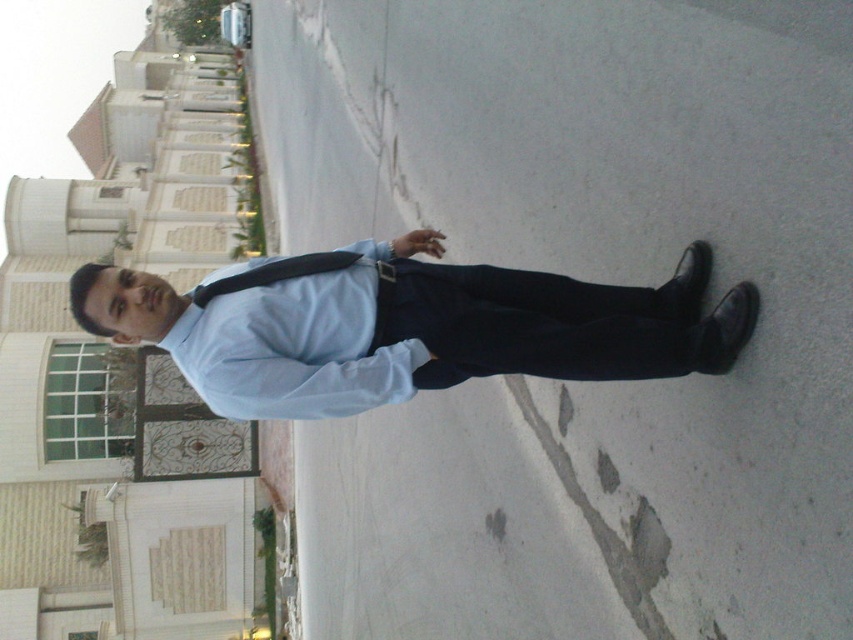
Can you confirm if matte blue shirt at center is positioned below light blue cotton dress shirt at center?

No, matte blue shirt at center is not below light blue cotton dress shirt at center.

Does matte blue shirt at center come in front of light blue cotton dress shirt at center?

Yes, matte blue shirt at center is closer to the viewer.

Between point (416, 294) and point (357, 278), which one is positioned behind?

The point (357, 278) is more distant.

This screenshot has width=853, height=640. What are the coordinates of `matte blue shirt at center` in the screenshot? It's located at (405, 324).

Is dark blue fabric pants at center wider than light blue cotton dress shirt at center?

Yes, dark blue fabric pants at center is wider than light blue cotton dress shirt at center.

Which is more to the left, dark blue fabric pants at center or light blue cotton dress shirt at center?

light blue cotton dress shirt at center is more to the left.

Is point (634, 301) more distant than point (218, 337)?

That is False.

At what (x,y) coordinates should I click in order to perform the action: click on dark blue fabric pants at center. Please return your answer as a coordinate pair (x, y). The width and height of the screenshot is (853, 640). Looking at the image, I should click on (538, 321).

Locate an element on the screen. The width and height of the screenshot is (853, 640). matte blue shirt at center is located at coordinates (405, 324).

The image size is (853, 640). What do you see at coordinates (405, 324) in the screenshot?
I see `matte blue shirt at center` at bounding box center [405, 324].

Is point (653, 289) positioned behind point (677, 314)?

Yes.

This screenshot has width=853, height=640. What are the coordinates of `matte blue shirt at center` in the screenshot? It's located at (405, 324).